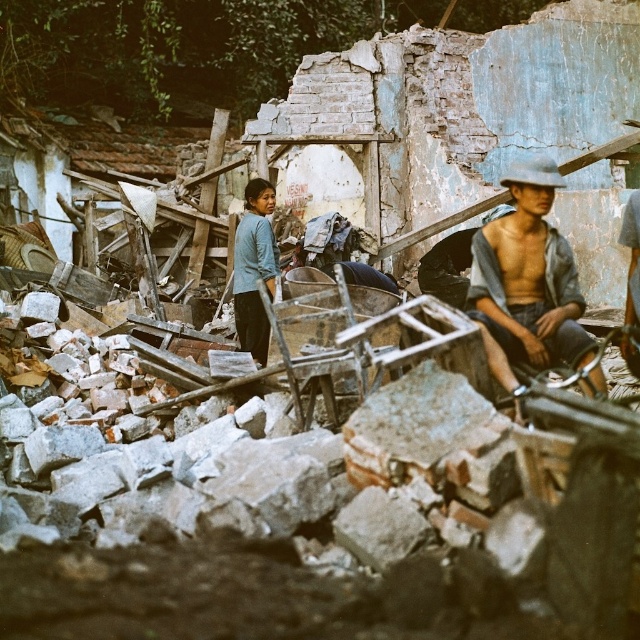
You are a rescue worker in the disaster area. You see a gray fabric shirt at center and a blue fabric shirt at center. Which one is closer to the ground?

The gray fabric shirt at center is positioned under blue fabric shirt at center, so the gray fabric shirt at center is closer to the ground.

You are a drone operator trying to capture images of the rubble pile. You have two points of interest marked on your screen at coordinates point (513, 248) and point (256, 266). Which point is closer to the camera to ensure better focus?

Point (513, 248) is closer to the camera than point (256, 266), so it will be in better focus.

You are standing at the point marked as point (528,280) in the image. What object is located exactly at this point?

The gray fabric shirt at center is located exactly at point (528,280).